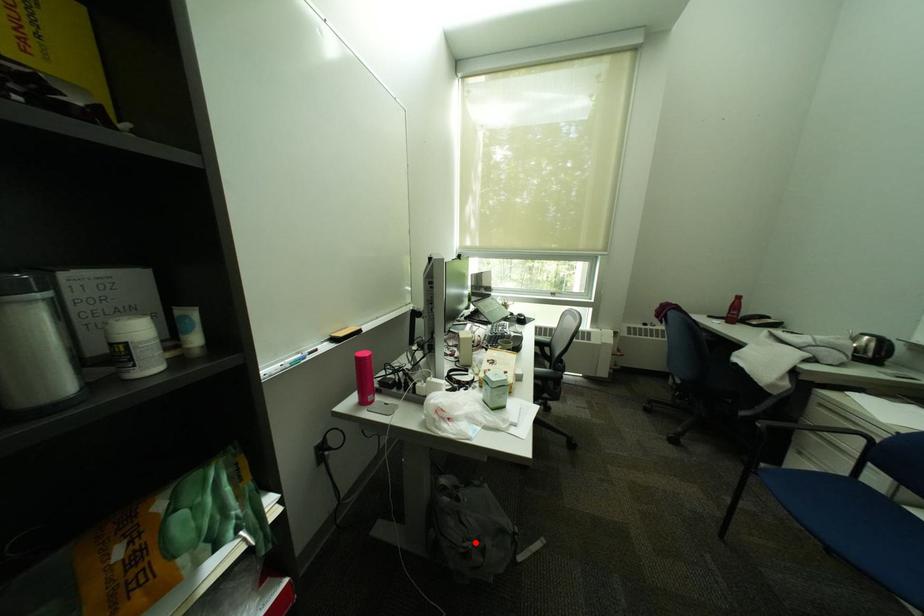
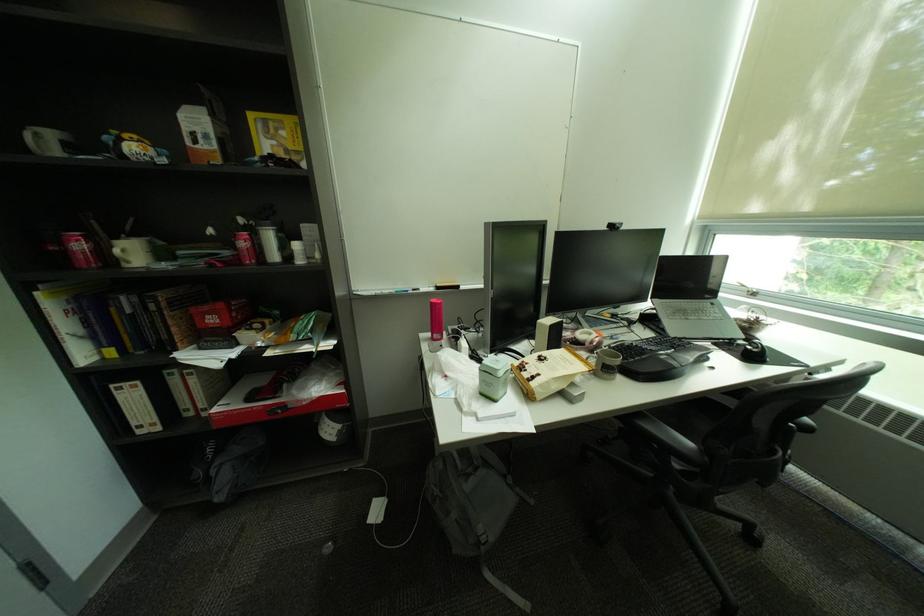
Locate, in the second image, the point that corresponds to the highlighted location in the first image.

(446, 487)